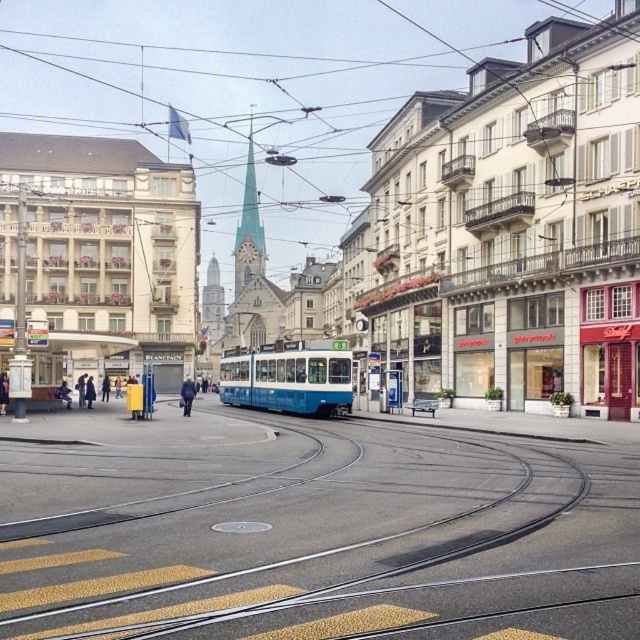
Question: Which point is farther to the camera?

Choices:
 (A) (532, 461)
 (B) (257, 228)

Answer: (B)

Question: Which object appears farthest from the camera in this image?

Choices:
 (A) smooth white spire at center
 (B) metallic track at center

Answer: (A)

Question: Can you confirm if metallic track at center is positioned below smooth white spire at center?

Choices:
 (A) yes
 (B) no

Answer: (A)

Question: Is metallic track at center wider than smooth white spire at center?

Choices:
 (A) no
 (B) yes

Answer: (B)

Question: In this image, where is metallic track at center located relative to smooth white spire at center?

Choices:
 (A) left
 (B) right

Answer: (B)